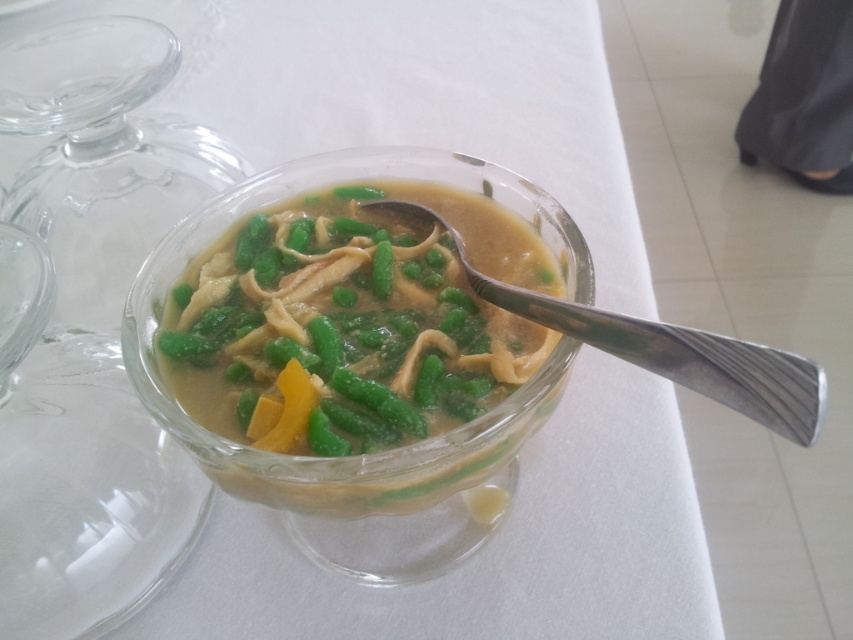
Measure the distance between translucent glass bowl at center and silver metallic spoon at center.

translucent glass bowl at center and silver metallic spoon at center are 1.20 inches apart from each other.

Which is behind, point (466, 236) or point (618, 339)?

Positioned behind is point (466, 236).

Where is `translucent glass bowl at center`? translucent glass bowl at center is located at coordinates (351, 323).